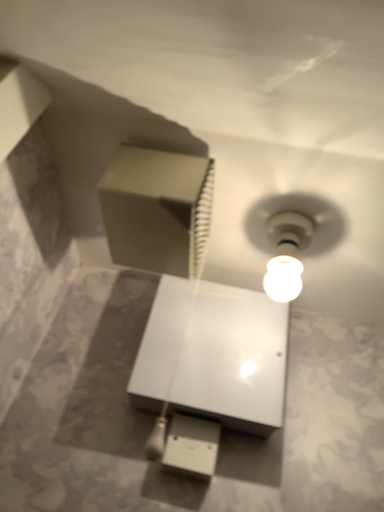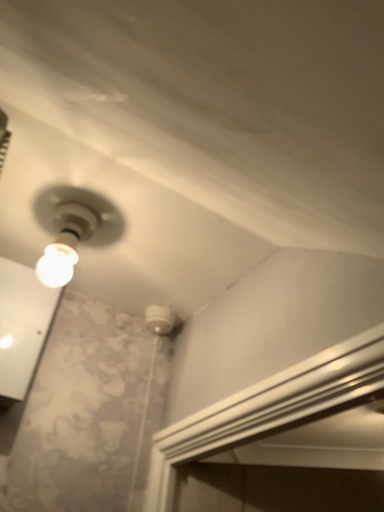
Question: How did the camera likely rotate when shooting the video?

Choices:
 (A) rotated right
 (B) rotated left

Answer: (A)